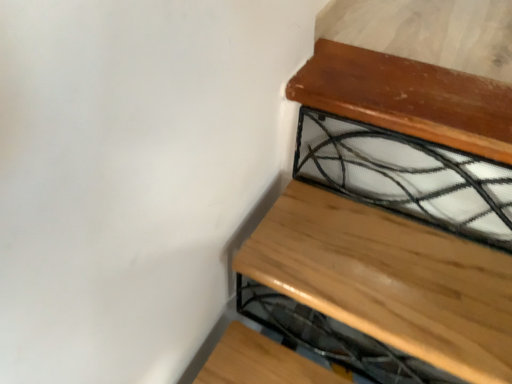
Question: Is natural wood stair at upper right in front of or behind clear glass at upper right in the image?

Choices:
 (A) front
 (B) behind

Answer: (A)

Question: Is natural wood stair at upper right taller or shorter than clear glass at upper right?

Choices:
 (A) short
 (B) tall

Answer: (A)

Question: Visually, is natural wood stair at upper right positioned to the left or to the right of clear glass at upper right?

Choices:
 (A) right
 (B) left

Answer: (B)

Question: From a real-world perspective, is clear glass at upper right physically located above or below natural wood stair at upper right?

Choices:
 (A) below
 (B) above

Answer: (B)

Question: Considering their positions, is clear glass at upper right located in front of or behind natural wood stair at upper right?

Choices:
 (A) behind
 (B) front

Answer: (A)

Question: In terms of width, does clear glass at upper right look wider or thinner when compared to natural wood stair at upper right?

Choices:
 (A) wide
 (B) thin

Answer: (B)

Question: Is point (331, 135) closer or farther from the camera than point (498, 139)?

Choices:
 (A) farther
 (B) closer

Answer: (A)